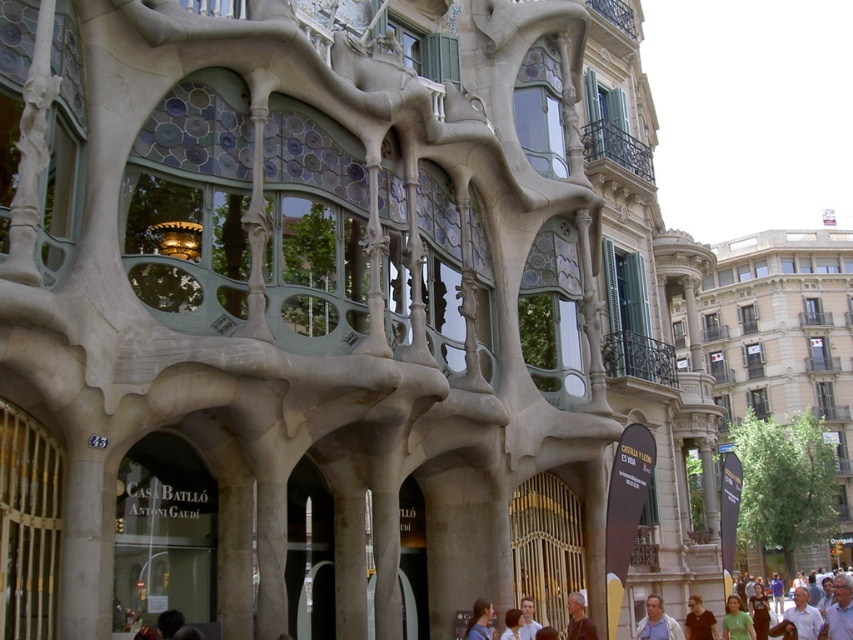
How far apart are light brown shirt at lower right and light brown hair at lower center?

The distance of light brown shirt at lower right from light brown hair at lower center is 10.10 meters.

Can you confirm if light brown shirt at lower right is positioned to the right of light brown hair at lower center?

Correct, you'll find light brown shirt at lower right to the right of light brown hair at lower center.

Is point (646, 625) positioned behind point (527, 596)?

No, (646, 625) is in front of (527, 596).

Find the location of `light brown shirt at lower right`. light brown shirt at lower right is located at coordinates (657, 621).

Which of these two, blue denim shirt at lower center or dark hair at lower center, stands taller?

blue denim shirt at lower center is taller.

At what (x,y) coordinates should I click in order to perform the action: click on blue denim shirt at lower center. Please return your answer as a coordinate pair (x, y). The image size is (853, 640). Looking at the image, I should click on (479, 620).

Between point (672, 634) and point (570, 598), which one is positioned behind?

The point (570, 598) is more distant.

Does light brown shirt at lower right have a lesser height compared to gray hair at lower center?

No, light brown shirt at lower right is not shorter than gray hair at lower center.

Is point (637, 630) less distant than point (579, 609)?

No, (637, 630) is further to viewer.

Find the location of a particular element. The height and width of the screenshot is (640, 853). light brown shirt at lower right is located at coordinates click(x=657, y=621).